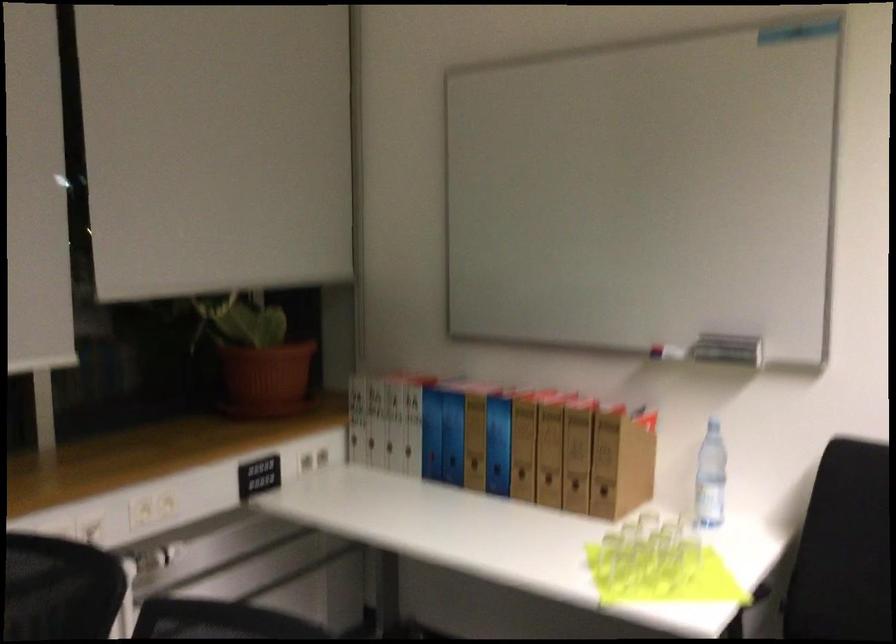
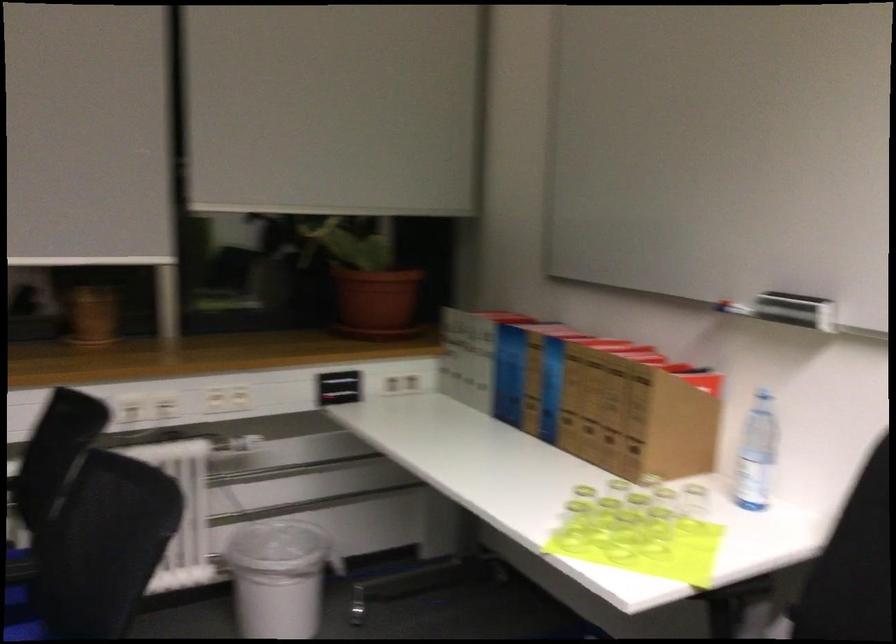
The point at (608, 574) is marked in the first image. Where is the corresponding point in the second image?

(573, 526)